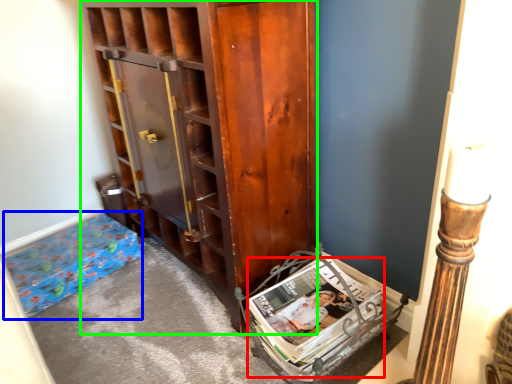
Question: Considering the real-world distances, which object is closest to magazine (highlighted by a red box)? furniture (highlighted by a blue box) or cabinetry (highlighted by a green box).

Choices:
 (A) furniture
 (B) cabinetry

Answer: (B)